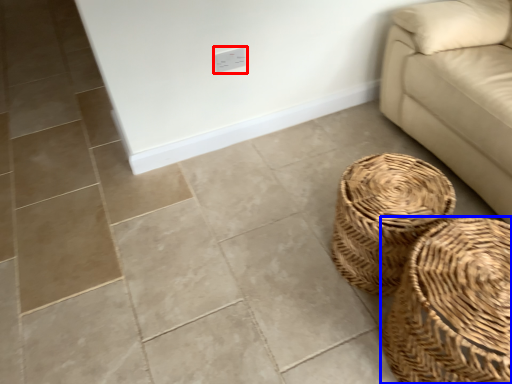
Question: Which object appears farthest to the camera in this image, electric outlet (highlighted by a red box) or basket (highlighted by a blue box)?

Choices:
 (A) electric outlet
 (B) basket

Answer: (A)